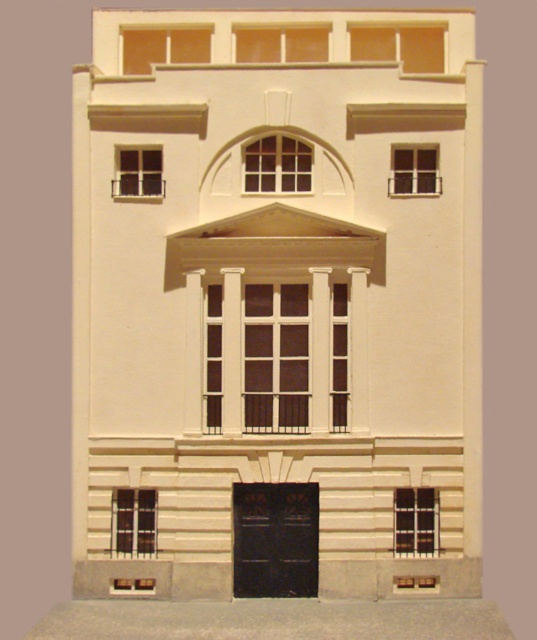
From the picture: You are an architect reviewing a miniature model of a building. You notice two points marked on the facade. The first point is at coordinates point (245, 372) and the second is at point (137, 36). From your viewing position, which point appears closer to you?

Point (245, 372) is in front of point (137, 36), so it appears closer to you.

You are an architect reviewing a model of a building. You notice a point at coordinates (275, 356). Based on the scene description, what object is located at this point?

The point at coordinates (275, 356) indicates the location of the matte glass window at center.